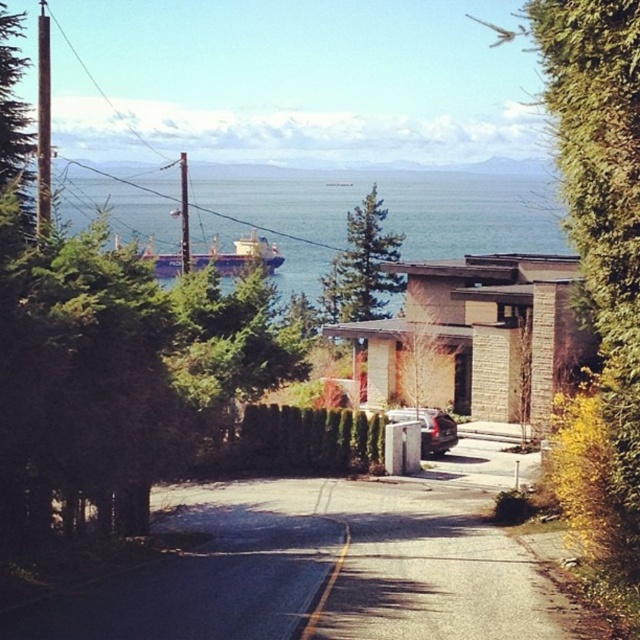
Question: Is blue metallic water at upper center thinner than metallic silver car at center?

Choices:
 (A) yes
 (B) no

Answer: (B)

Question: Is blue metallic water at upper center wider than metallic silver car at center?

Choices:
 (A) no
 (B) yes

Answer: (B)

Question: Considering the relative positions of blue metallic water at upper center and metallic silver car at center in the image provided, where is blue metallic water at upper center located with respect to metallic silver car at center?

Choices:
 (A) above
 (B) below

Answer: (A)